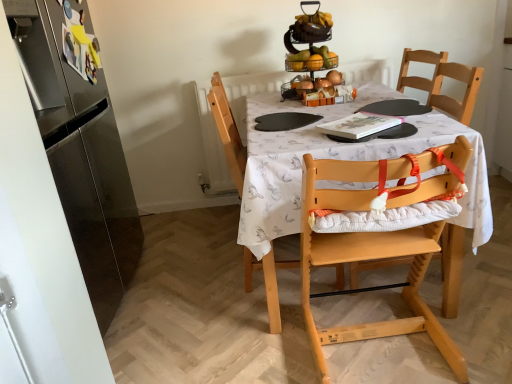
What are the coordinates of `satin silver refrigerator at left` in the screenshot? It's located at (80, 146).

What do you see at coordinates (80, 146) in the screenshot?
I see `satin silver refrigerator at left` at bounding box center [80, 146].

The image size is (512, 384). I want to click on wooden high chair at center, so click(334, 158).

This screenshot has height=384, width=512. I want to click on light wood highchair at center, positioned as the 2th chair in back-to-front order, so click(x=380, y=240).

Find the location of a particular element. metallic silver fruit basket at upper center is located at coordinates (311, 59).

Is light wood highchair at center, the first chair in the back-to-front sequence, to the right of metallic silver fruit basket at upper center from the viewer's perspective?

No, light wood highchair at center, the first chair in the back-to-front sequence, is not to the right of metallic silver fruit basket at upper center.

Who is taller, light wood highchair at center, the first chair in the back-to-front sequence, or metallic silver fruit basket at upper center?

Standing taller between the two is light wood highchair at center, the first chair in the back-to-front sequence.

Measure the distance from light wood highchair at center, the first chair in the back-to-front sequence, to metallic silver fruit basket at upper center.

light wood highchair at center, the first chair in the back-to-front sequence, is 21.59 inches from metallic silver fruit basket at upper center.

Is light wood highchair at center, the first chair in the back-to-front sequence, spatially inside metallic silver fruit basket at upper center, or outside of it?

light wood highchair at center, the first chair in the back-to-front sequence, is not inside metallic silver fruit basket at upper center, it's outside.

Which object is positioned more to the left, metallic silver fruit basket at upper center or satin silver refrigerator at left?

satin silver refrigerator at left.

Is point (286, 68) closer or farther from the camera than point (110, 116)?

Point (286, 68) is closer to the camera than point (110, 116).

Looking at this image, from a real-world perspective, which is physically below, metallic silver fruit basket at upper center or satin silver refrigerator at left?

In real-world perspective, satin silver refrigerator at left is lower.

Can you confirm if metallic silver fruit basket at upper center is thinner than satin silver refrigerator at left?

Correct, the width of metallic silver fruit basket at upper center is less than that of satin silver refrigerator at left.

From a real-world perspective, who is located lower, satin silver refrigerator at left or light wood highchair at center, the first chair in the front-to-back sequence?

light wood highchair at center, the first chair in the front-to-back sequence, from a real-world perspective.

Is the position of satin silver refrigerator at left more distant than that of light wood highchair at center, positioned as the 2th chair in back-to-front order?

Yes, it is behind light wood highchair at center, positioned as the 2th chair in back-to-front order.

Is satin silver refrigerator at left bigger than light wood highchair at center, positioned as the 2th chair in back-to-front order?

Correct, satin silver refrigerator at left is larger in size than light wood highchair at center, positioned as the 2th chair in back-to-front order.

You are a GUI agent. You are given a task and a screenshot of the screen. Output one action in this format:
    pyautogui.click(x=<x>, y=<y>)
    Task: Click on the refrigerator above the light wood highchair at center, positioned as the 2th chair in back-to-front order (from the image's perspective)
    This screenshot has height=384, width=512.
    Given the screenshot: What is the action you would take?
    pyautogui.click(x=80, y=146)

Is light wood highchair at center, the first chair in the front-to-back sequence, spatially inside wooden high chair at center, or outside of it?

light wood highchair at center, the first chair in the front-to-back sequence, is outside wooden high chair at center.

At what (x,y) coordinates should I click in order to perform the action: click on chair that is the 1st one when counting leftward from the wooden high chair at center. Please return your answer as a coordinate pair (x, y). Looking at the image, I should click on (380, 240).

How far apart are light wood highchair at center, positioned as the 2th chair in back-to-front order, and wooden high chair at center?

light wood highchair at center, positioned as the 2th chair in back-to-front order, and wooden high chair at center are 12.23 inches apart from each other.

Consider the image. What's the angular difference between light wood highchair at center, positioned as the 2th chair in back-to-front order, and wooden high chair at center's facing directions?

The angle between the facing direction of light wood highchair at center, positioned as the 2th chair in back-to-front order, and the facing direction of wooden high chair at center is 90 degrees.

In the image, is wooden high chair at center positioned in front of or behind light wood highchair at center, the first chair in the back-to-front sequence?

In the image, wooden high chair at center appears in front of light wood highchair at center, the first chair in the back-to-front sequence.

Is point (265, 197) farther from viewer compared to point (230, 122)?

No, (265, 197) is closer to viewer.

Could you tell me if wooden high chair at center is facing light wood highchair at center, the first chair in the back-to-front sequence?

Yes, wooden high chair at center is turned towards light wood highchair at center, the first chair in the back-to-front sequence.

In the scene shown: Is wooden high chair at center far away from light wood highchair at center, which is the second chair in front-to-back order?

No, there isn't a large distance between wooden high chair at center and light wood highchair at center, which is the second chair in front-to-back order.

Is point (286, 62) closer to viewer compared to point (230, 142)?

No, it is behind (230, 142).

From the image's perspective, is metallic silver fruit basket at upper center located above or below light wood highchair at center, which is the second chair in front-to-back order?

Clearly, from the image's perspective, metallic silver fruit basket at upper center is above light wood highchair at center, which is the second chair in front-to-back order.

In the scene shown: Could you tell me if metallic silver fruit basket at upper center is facing light wood highchair at center, which is the second chair in front-to-back order?

No, metallic silver fruit basket at upper center is not oriented towards light wood highchair at center, which is the second chair in front-to-back order.

Based on the photo, could you measure the distance between metallic silver fruit basket at upper center and light wood highchair at center, the first chair in the back-to-front sequence?

21.59 inches.

Is light wood highchair at center, positioned as the 2th chair in back-to-front order, surrounding satin silver refrigerator at left?

No, satin silver refrigerator at left is not surrounded by light wood highchair at center, positioned as the 2th chair in back-to-front order.

From a real-world perspective, starting from the satin silver refrigerator at left, which chair is the 2nd one below it? Please provide its 2D coordinates.

[(380, 240)]

From a real-world perspective, between light wood highchair at center, the first chair in the front-to-back sequence, and satin silver refrigerator at left, who is vertically lower?

light wood highchair at center, the first chair in the front-to-back sequence.

Which object is positioned more to the right, light wood highchair at center, the first chair in the front-to-back sequence, or satin silver refrigerator at left?

light wood highchair at center, the first chair in the front-to-back sequence, is more to the right.

There is a light wood highchair at center, which is the second chair in front-to-back order. Where is `fruit above it (from a real-world perspective)`? The image size is (512, 384). fruit above it (from a real-world perspective) is located at coordinates 311,59.

Locate an element on the screen. The width and height of the screenshot is (512, 384). refrigerator in front of the metallic silver fruit basket at upper center is located at coordinates (80, 146).

Which object lies further to the anchor point wooden high chair at center, light wood highchair at center, the first chair in the front-to-back sequence, or light wood highchair at center, the first chair in the back-to-front sequence?

Based on the image, light wood highchair at center, the first chair in the back-to-front sequence, appears to be further to wooden high chair at center.

Based on their spatial positions, is wooden high chair at center or metallic silver fruit basket at upper center closer to satin silver refrigerator at left?

The object closer to satin silver refrigerator at left is wooden high chair at center.

Based on their spatial positions, is light wood highchair at center, positioned as the 2th chair in back-to-front order, or satin silver refrigerator at left further from light wood highchair at center, the first chair in the back-to-front sequence?

Based on the image, satin silver refrigerator at left appears to be further to light wood highchair at center, the first chair in the back-to-front sequence.

When comparing their distances from metallic silver fruit basket at upper center, does wooden high chair at center or light wood highchair at center, positioned as the 2th chair in back-to-front order, seem closer?

wooden high chair at center is closer to metallic silver fruit basket at upper center.

Which object lies nearer to the anchor point satin silver refrigerator at left, metallic silver fruit basket at upper center or light wood highchair at center, the first chair in the front-to-back sequence?

light wood highchair at center, the first chair in the front-to-back sequence, is positioned closer to the anchor satin silver refrigerator at left.

In the scene shown: Looking at the image, which one is located further to light wood highchair at center, the first chair in the front-to-back sequence, metallic silver fruit basket at upper center or wooden high chair at center?

metallic silver fruit basket at upper center lies further to light wood highchair at center, the first chair in the front-to-back sequence, than the other object.

Based on their spatial positions, is light wood highchair at center, the first chair in the front-to-back sequence, or satin silver refrigerator at left further from wooden high chair at center?

satin silver refrigerator at left is positioned further to the anchor wooden high chair at center.

From the image, which object appears to be nearer to light wood highchair at center, positioned as the 2th chair in back-to-front order, wooden high chair at center or metallic silver fruit basket at upper center?

wooden high chair at center lies closer to light wood highchair at center, positioned as the 2th chair in back-to-front order, than the other object.

You are a GUI agent. You are given a task and a screenshot of the screen. Output one action in this format:
    pyautogui.click(x=<x>, y=<y>)
    Task: Click on the chair between satin silver refrigerator at left and light wood highchair at center, positioned as the 2th chair in back-to-front order, from left to right
    
    Given the screenshot: What is the action you would take?
    pyautogui.click(x=228, y=132)

I want to click on round table between light wood highchair at center, the first chair in the front-to-back sequence, and metallic silver fruit basket at upper center, along the z-axis, so click(x=334, y=158).

The image size is (512, 384). What are the coordinates of `fruit between satin silver refrigerator at left and wooden high chair at center from left to right` in the screenshot? It's located at coord(311,59).

Where is `chair between satin silver refrigerator at left and metallic silver fruit basket at upper center`? The image size is (512, 384). chair between satin silver refrigerator at left and metallic silver fruit basket at upper center is located at coordinates (228, 132).